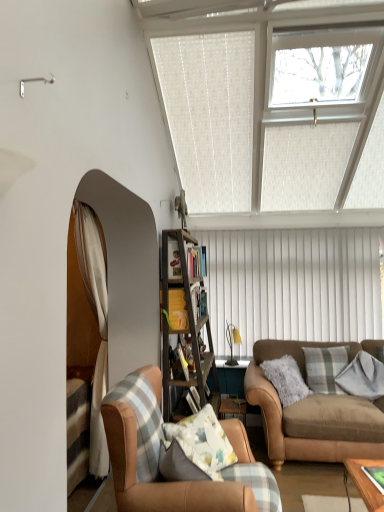
What is the approximate height of brown leather couch at lower right?

brown leather couch at lower right is 36.63 inches tall.

The image size is (384, 512). What do you see at coordinates (293, 285) in the screenshot?
I see `white vertical blinds at center` at bounding box center [293, 285].

The height and width of the screenshot is (512, 384). What do you see at coordinates (188, 328) in the screenshot?
I see `wooden ladder at center` at bounding box center [188, 328].

Locate an element on the screen. Image resolution: width=384 pixels, height=512 pixels. matte yellow lamp at center is located at coordinates (232, 342).

Describe the element at coordinates (325, 368) in the screenshot. The height and width of the screenshot is (512, 384). I see `plaid fabric pillow at center right, which is counted as the first pillow, starting from the left` at that location.

Measure the distance between point (377, 392) and camera.

Point (377, 392) and camera are 3.67 meters apart.

This screenshot has height=512, width=384. Identify the location of clear glass window at upper center. (320, 65).

Find the location of `brown leather couch at lower right`. brown leather couch at lower right is located at coordinates (314, 412).

Where is `pillow that is the 2nd object located below the wooden ladder at center (from the image's perspective)`? The image size is (384, 512). pillow that is the 2nd object located below the wooden ladder at center (from the image's perspective) is located at coordinates (362, 377).

Does gray flannel pillow at right, marked as the 2th pillow in a left-to-right arrangement, have a greater height compared to wooden ladder at center?

No, gray flannel pillow at right, marked as the 2th pillow in a left-to-right arrangement, is not taller than wooden ladder at center.

Choose the correct answer: Is gray flannel pillow at right, marked as the 2th pillow in a left-to-right arrangement, inside wooden ladder at center or outside it?

gray flannel pillow at right, marked as the 2th pillow in a left-to-right arrangement, exists outside the volume of wooden ladder at center.

In the scene shown: Considering the sizes of objects gray flannel pillow at right, positioned as the 1th pillow in right-to-left order, and wooden ladder at center in the image provided, who is thinner, gray flannel pillow at right, positioned as the 1th pillow in right-to-left order, or wooden ladder at center?

gray flannel pillow at right, positioned as the 1th pillow in right-to-left order.

In terms of height, does clear glass window at upper center look taller or shorter compared to wooden bookshelf at center, which is the third shelf from front to back?

Considering their sizes, clear glass window at upper center has more height than wooden bookshelf at center, which is the third shelf from front to back.

From a real-world perspective, is clear glass window at upper center positioned above or below wooden bookshelf at center, which is the third shelf from front to back?

clear glass window at upper center is above wooden bookshelf at center, which is the third shelf from front to back.

Is clear glass window at upper center far from wooden bookshelf at center, which is the third shelf from front to back?

clear glass window at upper center is far away from wooden bookshelf at center, which is the third shelf from front to back.

From the image's perspective, which one is positioned lower, matte yellow lamp at center or wooden bookshelf at center, which is the second shelf from back to front?

matte yellow lamp at center, from the image's perspective.

From the matte yellow lamp at center, count the 1st shelf to the left and point to it. Please provide its 2D coordinates.

[(198, 300)]

Which of these two, matte yellow lamp at center or wooden bookshelf at center, which is counted as the 2th shelf, starting from the front, stands taller?

Standing taller between the two is matte yellow lamp at center.

In terms of width, does matte yellow lamp at center look wider or thinner when compared to wooden bookshelf at center, which is counted as the 2th shelf, starting from the front?

matte yellow lamp at center is wider than wooden bookshelf at center, which is counted as the 2th shelf, starting from the front.

From the image's perspective, which is above, wooden bookshelf at center, which is the third shelf from front to back, or brown leather couch at lower right?

wooden bookshelf at center, which is the third shelf from front to back, from the image's perspective.

Considering the sizes of objects wooden bookshelf at center, which is the third shelf from front to back, and brown leather couch at lower right in the image provided, who is wider, wooden bookshelf at center, which is the third shelf from front to back, or brown leather couch at lower right?

brown leather couch at lower right is wider.

Measure the distance between wooden bookshelf at center, the 1th shelf from the back, and brown leather couch at lower right.

4.61 feet.

Is white vertical blinds at center with leather armchair at lower left?

No, white vertical blinds at center is not beside leather armchair at lower left.

Is white vertical blinds at center thinner than leather armchair at lower left?

Correct, the width of white vertical blinds at center is less than that of leather armchair at lower left.

Can leather armchair at lower left be found inside white vertical blinds at center?

No, white vertical blinds at center does not contain leather armchair at lower left.

Considering the sizes of objects white vertical blinds at center and leather armchair at lower left in the image provided, who is smaller, white vertical blinds at center or leather armchair at lower left?

Smaller between the two is white vertical blinds at center.

From a real-world perspective, relative to wooden bookshelf at center, which is the third shelf from front to back, is wooden ladder at center vertically above or below?

From a real-world perspective, wooden ladder at center is physically below wooden bookshelf at center, which is the third shelf from front to back.

Can you confirm if wooden ladder at center is bigger than wooden bookshelf at center, which is the third shelf from front to back?

Correct, wooden ladder at center is larger in size than wooden bookshelf at center, which is the third shelf from front to back.

Is wooden ladder at center in contact with wooden bookshelf at center, which is the third shelf from front to back?

No.

How far apart are wooden ladder at center and wooden bookshelf at center, the 1th shelf from the back?

The distance of wooden ladder at center from wooden bookshelf at center, the 1th shelf from the back, is 41.25 centimeters.

In the image, is clear glass window at upper center positioned in front of or behind wooden ladder at center?

Clearly, clear glass window at upper center is in front of wooden ladder at center.

From the image's perspective, which one is positioned higher, clear glass window at upper center or wooden ladder at center?

clear glass window at upper center appears higher in the image.

Is clear glass window at upper center bigger or smaller than wooden ladder at center?

clear glass window at upper center is smaller than wooden ladder at center.

Could you tell me if clear glass window at upper center is facing wooden ladder at center?

No, clear glass window at upper center does not turn towards wooden ladder at center.

The height and width of the screenshot is (512, 384). I want to click on cabinetry lying on the left of gray flannel pillow at right, marked as the 2th pillow in a left-to-right arrangement, so click(x=188, y=328).

Identify the location of the 3rd shelf behind the clear glass window at upper center. (196, 261).

From the image, which object appears to be farther from matte yellow lamp at center, gray flannel pillow at right, positioned as the 1th pillow in right-to-left order, or clear glass window at upper center?

The object further to matte yellow lamp at center is clear glass window at upper center.

Estimate the real-world distances between objects in this image. Which object is further from leather armchair at lower left, yellow fabric at center, which is counted as the third shelf, starting from the back, or gray flannel pillow at right, marked as the 2th pillow in a left-to-right arrangement?

gray flannel pillow at right, marked as the 2th pillow in a left-to-right arrangement, is further to leather armchair at lower left.

Which object lies nearer to the anchor point brown leather couch at lower right, white vertical blinds at center or gray flannel pillow at right, positioned as the 1th pillow in right-to-left order?

gray flannel pillow at right, positioned as the 1th pillow in right-to-left order, is positioned closer to the anchor brown leather couch at lower right.

Which object lies nearer to the anchor point white vertical blinds at center, plaid fabric pillow at center right, which is counted as the first pillow, starting from the left, or brown leather couch at lower right?

Based on the image, plaid fabric pillow at center right, which is counted as the first pillow, starting from the left, appears to be nearer to white vertical blinds at center.

Estimate the real-world distances between objects in this image. Which object is closer to wooden bookshelf at center, the 1th shelf from the back, wooden ladder at center or leather armchair at lower left?

wooden ladder at center is closer to wooden bookshelf at center, the 1th shelf from the back.

When comparing their distances from plaid fabric pillow at center right, which is counted as the first pillow, starting from the left, does white vertical blinds at center or matte yellow lamp at center seem closer?

white vertical blinds at center is positioned closer to the anchor plaid fabric pillow at center right, which is counted as the first pillow, starting from the left.

Estimate the real-world distances between objects in this image. Which object is closer to wooden bookshelf at center, which is the third shelf from front to back, white vertical blinds at center or wooden bookshelf at center, which is the second shelf from back to front?

wooden bookshelf at center, which is the second shelf from back to front.

When comparing their distances from brown leather couch at lower right, does yellow fabric at center, which is counted as the third shelf, starting from the back, or wooden ladder at center seem closer?

wooden ladder at center is positioned closer to the anchor brown leather couch at lower right.

The width and height of the screenshot is (384, 512). I want to click on blind positioned between yellow fabric at center, which is counted as the third shelf, starting from the back, and matte yellow lamp at center from near to far, so click(x=293, y=285).

Locate an element on the screen. lamp between clear glass window at upper center and leather armchair at lower left from top to bottom is located at coordinates (232, 342).

The height and width of the screenshot is (512, 384). Find the location of `shelf located between wooden ladder at center and wooden bookshelf at center, which is the second shelf from back to front, in the depth direction`. shelf located between wooden ladder at center and wooden bookshelf at center, which is the second shelf from back to front, in the depth direction is located at coordinates (175, 311).

I want to click on studio couch located between leather armchair at lower left and white vertical blinds at center in the depth direction, so click(x=314, y=412).